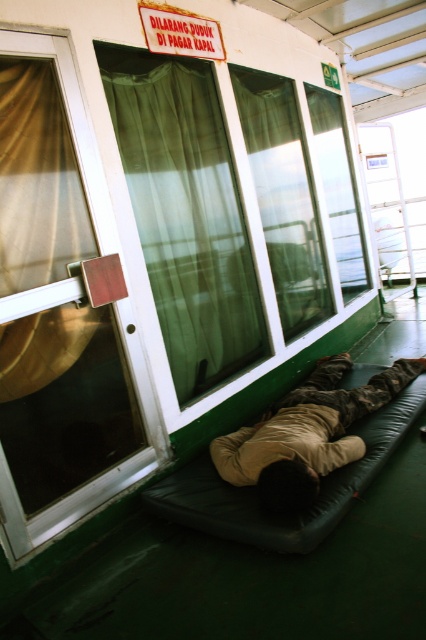
Does green sheer curtain at upper center have a smaller size compared to translucent fabric curtain at left?

Actually, green sheer curtain at upper center might be larger than translucent fabric curtain at left.

Is point (160, 244) closer to viewer compared to point (63, 144)?

That is False.

Find the location of a particular element. green sheer curtain at upper center is located at coordinates (186, 212).

At what (x,y) coordinates should I click in order to perform the action: click on green sheer curtain at upper center. Please return your answer as a coordinate pair (x, y). This screenshot has height=640, width=426. Looking at the image, I should click on (186, 212).

Image resolution: width=426 pixels, height=640 pixels. What do you see at coordinates (37, 180) in the screenshot? I see `translucent fabric curtain at left` at bounding box center [37, 180].

Does translucent fabric curtain at left appear on the right side of camouflage fabric person at lower center?

In fact, translucent fabric curtain at left is to the left of camouflage fabric person at lower center.

Image resolution: width=426 pixels, height=640 pixels. Describe the element at coordinates (37, 180) in the screenshot. I see `translucent fabric curtain at left` at that location.

I want to click on translucent fabric curtain at left, so click(x=37, y=180).

Can you confirm if green sheer curtain at upper center is shorter than camouflage fabric person at lower center?

In fact, green sheer curtain at upper center may be taller than camouflage fabric person at lower center.

Who is taller, green sheer curtain at upper center or camouflage fabric person at lower center?

green sheer curtain at upper center is taller.

The image size is (426, 640). What are the coordinates of `green sheer curtain at upper center` in the screenshot? It's located at (186, 212).

Where is `green sheer curtain at upper center`? This screenshot has height=640, width=426. green sheer curtain at upper center is located at coordinates (186, 212).